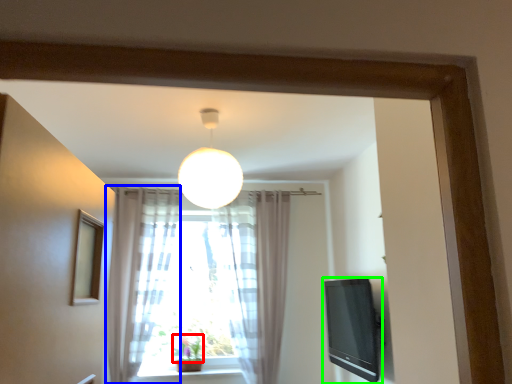
Question: Estimate the real-world distances between objects in this image. Which object is farther from plant (highlighted by a red box), curtain (highlighted by a blue box) or television (highlighted by a green box)?

Choices:
 (A) curtain
 (B) television

Answer: (B)